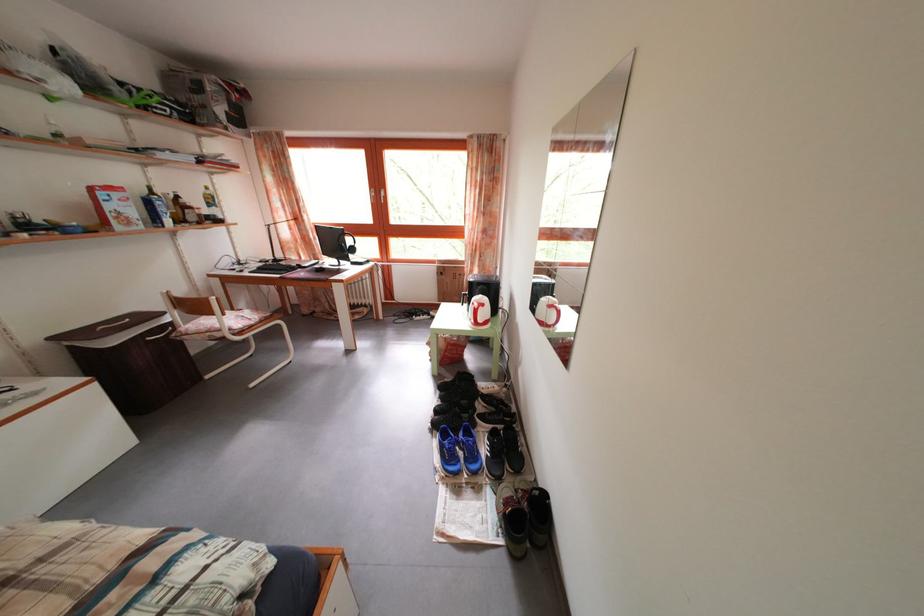
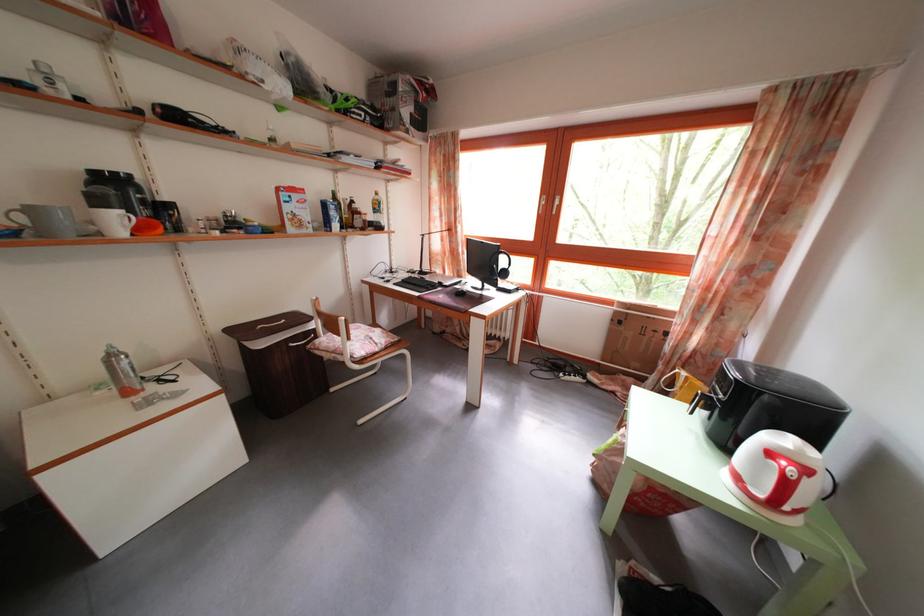
Find the pixel in the second image that matches pixel 445 275 in the first image.

(623, 320)